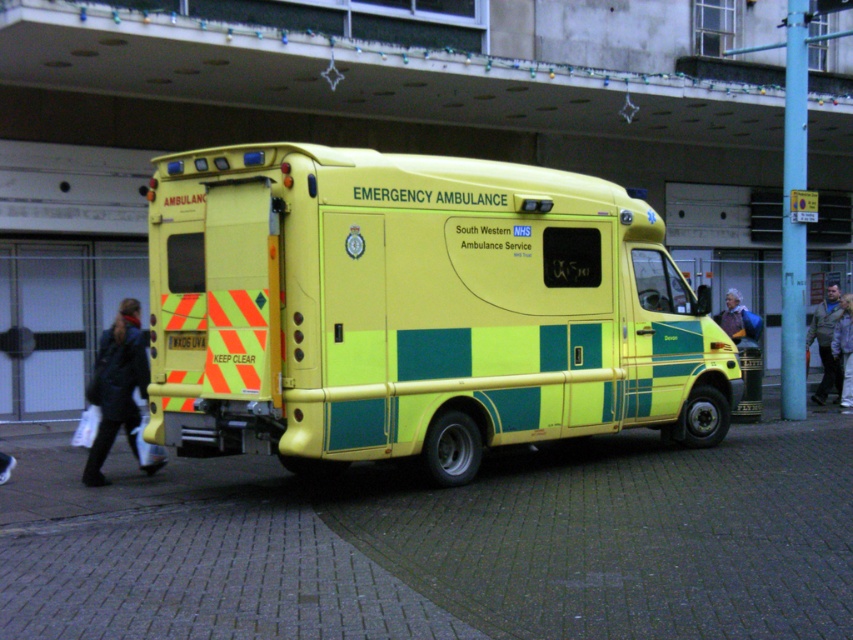
Question: Based on their relative distances, which object is nearer to the light gray fabric jacket at lower right?

Choices:
 (A) dark blue jacket at lower left
 (B) blue fabric jacket at center
 (C) yellow/green painted ambulance at center

Answer: (B)

Question: Is light gray fabric jacket at lower right below blue fabric jacket at center?

Choices:
 (A) yes
 (B) no

Answer: (A)

Question: Which object is the farthest from the yellow/green painted ambulance at center?

Choices:
 (A) dark brown leather jacket at lower right
 (B) blue fabric jacket at center
 (C) dark blue jacket at lower left

Answer: (A)

Question: Is yellow/green painted ambulance at center wider than light gray fabric jacket at lower right?

Choices:
 (A) yes
 (B) no

Answer: (A)

Question: Is the position of dark blue jacket at lower left less distant than that of dark brown leather jacket at lower right?

Choices:
 (A) no
 (B) yes

Answer: (B)

Question: Which object is farther from the camera taking this photo?

Choices:
 (A) light gray fabric jacket at lower right
 (B) blue fabric jacket at center
 (C) dark brown leather jacket at lower right

Answer: (C)